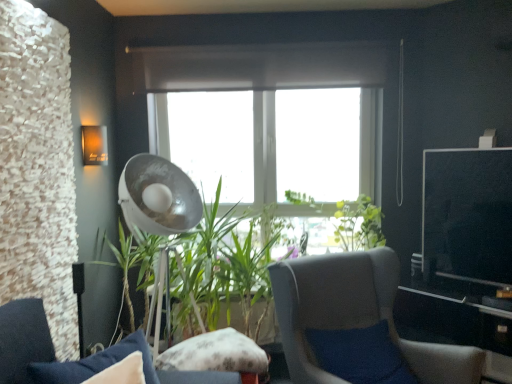
Question: Does matte orange wall sconce at upper left have a greater height compared to fluffy fabric pillow at center?

Choices:
 (A) no
 (B) yes

Answer: (B)

Question: Does matte orange wall sconce at upper left come in front of fluffy fabric pillow at center?

Choices:
 (A) no
 (B) yes

Answer: (A)

Question: Is matte orange wall sconce at upper left aimed at fluffy fabric pillow at center?

Choices:
 (A) no
 (B) yes

Answer: (A)

Question: Is fluffy fabric pillow at center located within matte orange wall sconce at upper left?

Choices:
 (A) no
 (B) yes

Answer: (A)

Question: Is matte orange wall sconce at upper left to the right of fluffy fabric pillow at center from the viewer's perspective?

Choices:
 (A) yes
 (B) no

Answer: (B)

Question: Can you confirm if matte orange wall sconce at upper left is positioned to the left of fluffy fabric pillow at center?

Choices:
 (A) yes
 (B) no

Answer: (A)

Question: From the image's perspective, does green leafy plant at center appear higher than gray fabric chair at center, the 2th chair when ordered from left to right?

Choices:
 (A) yes
 (B) no

Answer: (A)

Question: Is green leafy plant at center taller than gray fabric chair at center, the first chair when ordered from right to left?

Choices:
 (A) yes
 (B) no

Answer: (A)

Question: Is green leafy plant at center directly adjacent to gray fabric chair at center, the first chair when ordered from right to left?

Choices:
 (A) yes
 (B) no

Answer: (B)

Question: Can you confirm if green leafy plant at center is smaller than gray fabric chair at center, the first chair when ordered from right to left?

Choices:
 (A) yes
 (B) no

Answer: (B)

Question: Considering the relative sizes of green leafy plant at center and gray fabric chair at center, the 2th chair when ordered from left to right, in the image provided, is green leafy plant at center bigger than gray fabric chair at center, the 2th chair when ordered from left to right,?

Choices:
 (A) no
 (B) yes

Answer: (B)

Question: Is gray fabric chair at center, the 2th chair when ordered from left to right, located within green leafy plant at center?

Choices:
 (A) yes
 (B) no

Answer: (B)

Question: Can you confirm if fluffy fabric pillow at center is smaller than gray fabric chair at center, the 2th chair when ordered from left to right?

Choices:
 (A) no
 (B) yes

Answer: (B)